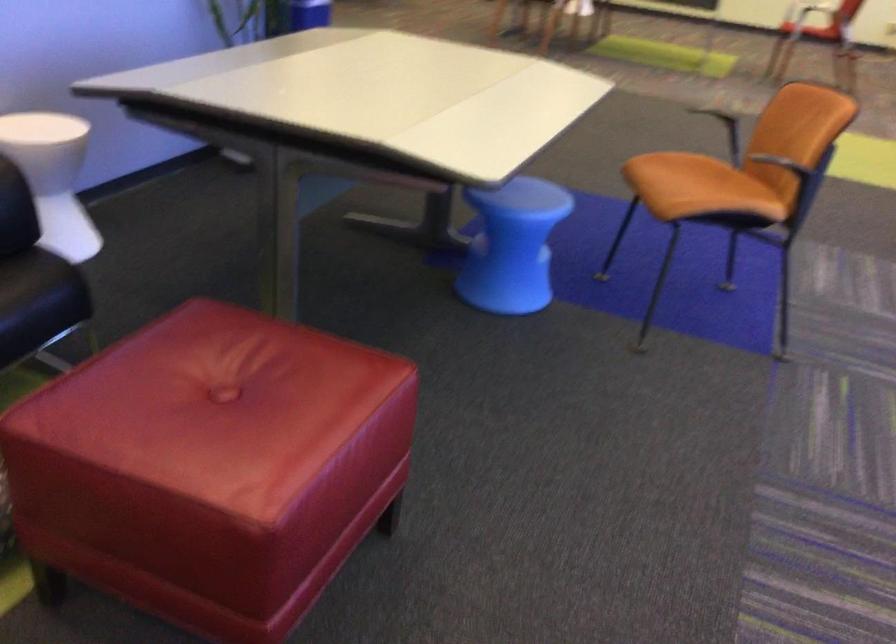
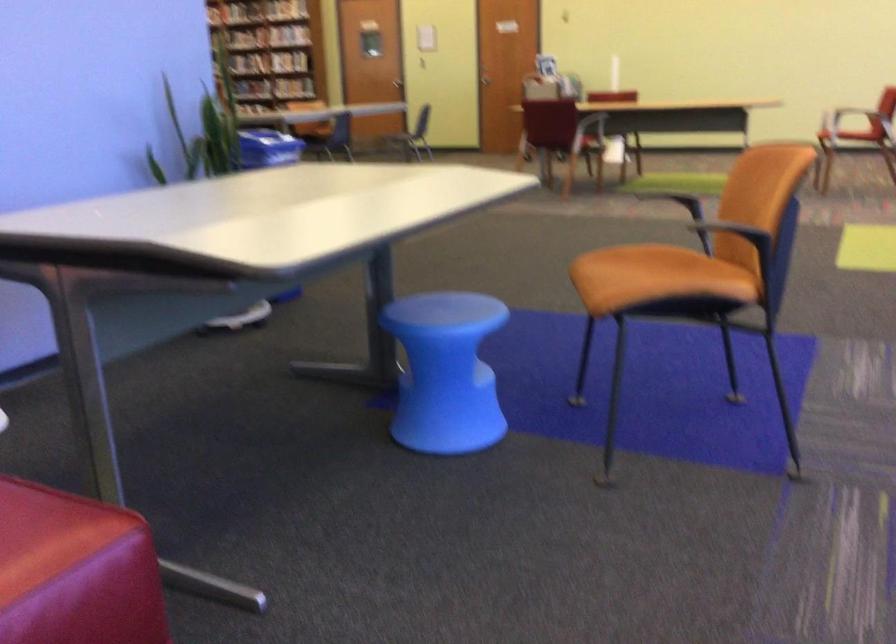
Question: The first image is from the beginning of the video and the second image is from the end. How did the camera likely rotate when shooting the video?

Choices:
 (A) Left
 (B) Right
 (C) Up
 (D) Down

Answer: (C)